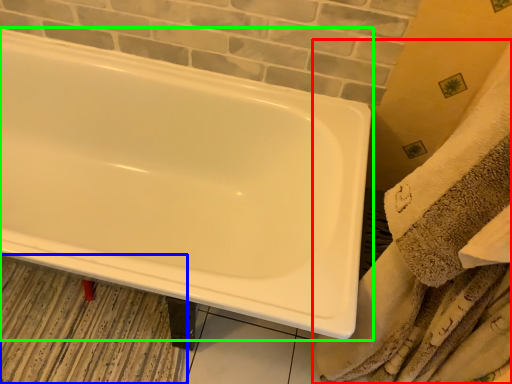
Question: Based on their relative distances, which object is nearer to bath towel (highlighted by a red box)? Choose from bath mat (highlighted by a blue box) and bathtub (highlighted by a green box).

Choices:
 (A) bath mat
 (B) bathtub

Answer: (B)